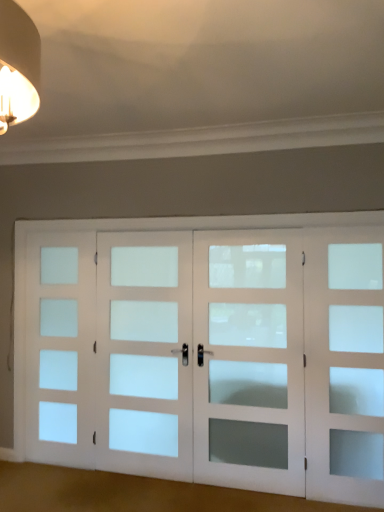
Based on the photo, measure the distance between point (138, 319) and camera.

The depth of point (138, 319) is 3.49 meters.

Identify the location of satin white glass door at center, the second screen door viewed from the left. This screenshot has width=384, height=512. (144, 354).

In order to click on white frosted glass door at center, acting as the second screen door starting from the right in this screenshot , I will do `click(248, 360)`.

Locate an element on the screen. This screenshot has width=384, height=512. white frosted glass door at left, which appears as the 1th screen door when viewed from the left is located at coordinates (60, 348).

Find the location of `white frosted glass door at right, which is the first screen door in right-to-left order`. white frosted glass door at right, which is the first screen door in right-to-left order is located at coordinates (344, 365).

Locate an element on the screen. This screenshot has width=384, height=512. satin white glass door at center, the second screen door viewed from the left is located at coordinates (144, 354).

Which object is positioned more to the left, white frosted glass door at center, the third screen door in the left-to-right sequence, or satin white glass door at center, which is counted as the third screen door, starting from the right?

Positioned to the left is satin white glass door at center, which is counted as the third screen door, starting from the right.

Is the position of white frosted glass door at center, the third screen door in the left-to-right sequence, less distant than that of satin white glass door at center, the second screen door viewed from the left?

That is True.

Between point (285, 298) and point (146, 466), which one is positioned behind?

The point (146, 466) is behind.

Who is shorter, white frosted glass door at center, acting as the second screen door starting from the right, or satin white glass door at center, which is counted as the third screen door, starting from the right?

white frosted glass door at center, acting as the second screen door starting from the right, is shorter.

How many degrees apart are the facing directions of satin white glass door at center, which is counted as the third screen door, starting from the right, and white frosted glass door at center, acting as the second screen door starting from the right?

The angular difference between satin white glass door at center, which is counted as the third screen door, starting from the right, and white frosted glass door at center, acting as the second screen door starting from the right, is 0.00333 degrees.

From a real-world perspective, relative to white frosted glass door at center, the third screen door in the left-to-right sequence, is satin white glass door at center, the second screen door viewed from the left, vertically above or below?

From a real-world perspective, satin white glass door at center, the second screen door viewed from the left, is physically below white frosted glass door at center, the third screen door in the left-to-right sequence.

Is satin white glass door at center, the second screen door viewed from the left, wider than white frosted glass door at center, acting as the second screen door starting from the right?

In fact, satin white glass door at center, the second screen door viewed from the left, might be narrower than white frosted glass door at center, acting as the second screen door starting from the right.

Considering the relative sizes of satin white glass door at center, the second screen door viewed from the left, and white frosted glass door at center, acting as the second screen door starting from the right, in the image provided, is satin white glass door at center, the second screen door viewed from the left, smaller than white frosted glass door at center, acting as the second screen door starting from the right,?

No, satin white glass door at center, the second screen door viewed from the left, is not smaller than white frosted glass door at center, acting as the second screen door starting from the right.

Based on their positions, is white frosted glass door at center, acting as the second screen door starting from the right, located to the left or right of white frosted glass door at left, which is the fourth screen door from right to left?

In the image, white frosted glass door at center, acting as the second screen door starting from the right, appears on the right side of white frosted glass door at left, which is the fourth screen door from right to left.

Locate an element on the screen. This screenshot has height=512, width=384. the 3rd screen door below when counting from the white frosted glass door at center, the third screen door in the left-to-right sequence (from the image's perspective) is located at coordinates (60, 348).

Is white frosted glass door at left, which is the fourth screen door from right to left, surrounded by white frosted glass door at center, acting as the second screen door starting from the right?

No, white frosted glass door at left, which is the fourth screen door from right to left, is located outside of white frosted glass door at center, acting as the second screen door starting from the right.

From a real-world perspective, which object stands above the other?

In real-world perspective, white frosted glass door at center, the third screen door in the left-to-right sequence, is above.

Is white frosted glass door at left, which is the fourth screen door from right to left, not inside white frosted glass door at center, the third screen door in the left-to-right sequence?

That's correct, white frosted glass door at left, which is the fourth screen door from right to left, is outside of white frosted glass door at center, the third screen door in the left-to-right sequence.

Which object is positioned more to the right, white frosted glass door at left, which is the fourth screen door from right to left, or white frosted glass door at center, the third screen door in the left-to-right sequence?

white frosted glass door at center, the third screen door in the left-to-right sequence, is more to the right.

Is white frosted glass door at left, which appears as the 1th screen door when viewed from the left, taller or shorter than white frosted glass door at center, acting as the second screen door starting from the right?

Considering their sizes, white frosted glass door at left, which appears as the 1th screen door when viewed from the left, has more height than white frosted glass door at center, acting as the second screen door starting from the right.

Is point (64, 422) positioned in front of point (300, 450)?

No, it is not.

From the image's perspective, is satin white glass door at center, which is counted as the third screen door, starting from the right, positioned above or below white frosted glass door at left, which is the fourth screen door from right to left?

satin white glass door at center, which is counted as the third screen door, starting from the right, is above white frosted glass door at left, which is the fourth screen door from right to left.

Considering the relative sizes of satin white glass door at center, the second screen door viewed from the left, and white frosted glass door at left, which appears as the 1th screen door when viewed from the left, in the image provided, is satin white glass door at center, the second screen door viewed from the left, taller than white frosted glass door at left, which appears as the 1th screen door when viewed from the left,?

No, satin white glass door at center, the second screen door viewed from the left, is not taller than white frosted glass door at left, which appears as the 1th screen door when viewed from the left.

Can you confirm if satin white glass door at center, which is counted as the third screen door, starting from the right, is bigger than white frosted glass door at left, which appears as the 1th screen door when viewed from the left?

Correct, satin white glass door at center, which is counted as the third screen door, starting from the right, is larger in size than white frosted glass door at left, which appears as the 1th screen door when viewed from the left.

Can you confirm if satin white glass door at center, the second screen door viewed from the left, is wider than white frosted glass door at left, which appears as the 1th screen door when viewed from the left?

Indeed, satin white glass door at center, the second screen door viewed from the left, has a greater width compared to white frosted glass door at left, which appears as the 1th screen door when viewed from the left.

Is white frosted glass door at right, which is counted as the fourth screen door, starting from the left, facing towards satin white glass door at center, the second screen door viewed from the left?

No, white frosted glass door at right, which is counted as the fourth screen door, starting from the left, is not turned towards satin white glass door at center, the second screen door viewed from the left.

The image size is (384, 512). What are the coordinates of `screen door that is the 2nd one below the satin white glass door at center, the second screen door viewed from the left (from a real-world perspective)` in the screenshot? It's located at (344, 365).

Considering the positions of objects white frosted glass door at right, which is the first screen door in right-to-left order, and satin white glass door at center, which is counted as the third screen door, starting from the right, in the image provided, who is more to the right, white frosted glass door at right, which is the first screen door in right-to-left order, or satin white glass door at center, which is counted as the third screen door, starting from the right,?

Positioned to the right is white frosted glass door at right, which is the first screen door in right-to-left order.

From the image's perspective, which object appears higher, white frosted glass door at right, which is counted as the fourth screen door, starting from the left, or white frosted glass door at left, which appears as the 1th screen door when viewed from the left?

white frosted glass door at right, which is counted as the fourth screen door, starting from the left, is shown above in the image.

From a real-world perspective, who is located lower, white frosted glass door at right, which is the first screen door in right-to-left order, or white frosted glass door at left, which appears as the 1th screen door when viewed from the left?

white frosted glass door at right, which is the first screen door in right-to-left order.

Considering the relative positions of white frosted glass door at right, which is the first screen door in right-to-left order, and white frosted glass door at left, which appears as the 1th screen door when viewed from the left, in the image provided, is white frosted glass door at right, which is the first screen door in right-to-left order, to the left or to the right of white frosted glass door at left, which appears as the 1th screen door when viewed from the left,?

From the image, it's evident that white frosted glass door at right, which is the first screen door in right-to-left order, is to the right of white frosted glass door at left, which appears as the 1th screen door when viewed from the left.

Which point is more distant from viewer, (365,475) or (47,238)?

The point (47,238) is farther.

This screenshot has width=384, height=512. I want to click on screen door that is the 2nd object located above the satin white glass door at center, which is counted as the third screen door, starting from the right (from the image's perspective), so click(x=248, y=360).

Image resolution: width=384 pixels, height=512 pixels. In order to click on the 1st screen door located beneath the white frosted glass door at center, the third screen door in the left-to-right sequence (from a real-world perspective) in this screenshot , I will do `click(144, 354)`.

From the picture: Considering their positions, is white frosted glass door at center, acting as the second screen door starting from the right, positioned closer to white frosted glass door at right, which is the first screen door in right-to-left order, than white frosted glass door at left, which appears as the 1th screen door when viewed from the left?

white frosted glass door at center, acting as the second screen door starting from the right, lies closer to white frosted glass door at right, which is the first screen door in right-to-left order, than the other object.

Based on their spatial positions, is white frosted glass door at left, which is the fourth screen door from right to left, or satin white glass door at center, which is counted as the third screen door, starting from the right, closer to white frosted glass door at center, acting as the second screen door starting from the right?

satin white glass door at center, which is counted as the third screen door, starting from the right, is closer to white frosted glass door at center, acting as the second screen door starting from the right.

Considering their positions, is white frosted glass door at center, acting as the second screen door starting from the right, positioned further to white frosted glass door at right, which is the first screen door in right-to-left order, than satin white glass door at center, the second screen door viewed from the left?

Based on the image, satin white glass door at center, the second screen door viewed from the left, appears to be further to white frosted glass door at right, which is the first screen door in right-to-left order.

Estimate the real-world distances between objects in this image. Which object is closer to white frosted glass door at left, which is the fourth screen door from right to left, satin white glass door at center, the second screen door viewed from the left, or white frosted glass door at right, which is the first screen door in right-to-left order?

satin white glass door at center, the second screen door viewed from the left.

Which object lies nearer to the anchor point satin white glass door at center, the second screen door viewed from the left, white frosted glass door at right, which is the first screen door in right-to-left order, or white frosted glass door at center, the third screen door in the left-to-right sequence?

white frosted glass door at center, the third screen door in the left-to-right sequence, is positioned closer to the anchor satin white glass door at center, the second screen door viewed from the left.

Considering their positions, is white frosted glass door at left, which appears as the 1th screen door when viewed from the left, positioned closer to white frosted glass door at right, which is counted as the fourth screen door, starting from the left, than white frosted glass door at center, the third screen door in the left-to-right sequence?

white frosted glass door at center, the third screen door in the left-to-right sequence, is positioned closer to the anchor white frosted glass door at right, which is counted as the fourth screen door, starting from the left.

Estimate the real-world distances between objects in this image. Which object is closer to satin white glass door at center, which is counted as the third screen door, starting from the right, white frosted glass door at left, which is the fourth screen door from right to left, or white frosted glass door at right, which is the first screen door in right-to-left order?

white frosted glass door at left, which is the fourth screen door from right to left, lies closer to satin white glass door at center, which is counted as the third screen door, starting from the right, than the other object.

From the image, which object appears to be farther from white frosted glass door at right, which is counted as the fourth screen door, starting from the left, satin white glass door at center, the second screen door viewed from the left, or white frosted glass door at center, the third screen door in the left-to-right sequence?

satin white glass door at center, the second screen door viewed from the left.

You are a GUI agent. You are given a task and a screenshot of the screen. Output one action in this format:
    pyautogui.click(x=<x>, y=<y>)
    Task: Click on the screen door situated between white frosted glass door at left, which is the fourth screen door from right to left, and white frosted glass door at center, the third screen door in the left-to-right sequence, from left to right
    This screenshot has width=384, height=512.
    Given the screenshot: What is the action you would take?
    pyautogui.click(x=144, y=354)

Locate an element on the screen. This screenshot has width=384, height=512. screen door between satin white glass door at center, which is counted as the third screen door, starting from the right, and white frosted glass door at right, which is the first screen door in right-to-left order is located at coordinates (248, 360).